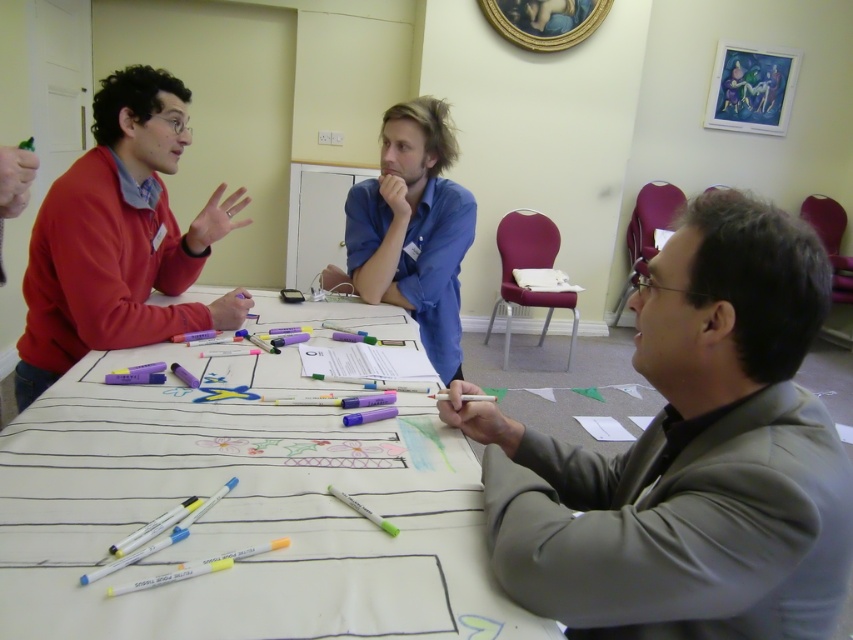
You are one of the participants in the meeting. You need to sign your name on the white paper at center. Where should you position yourself relative to the blue cotton shirt at center to access the paper?

You should position yourself in front of the blue cotton shirt at center because the white paper at center is located in front of it, allowing easy access for signing.

You are organizing a meeting and need to place a name tag on the table. The name tag is as wide as the matte red sweater at left. Will it fit on the white paper at center?

The white paper at center might be wider than matte red sweater at left, so the name tag could fit if the paper is wide enough, but there is uncertainty due to the comparison being uncertain.